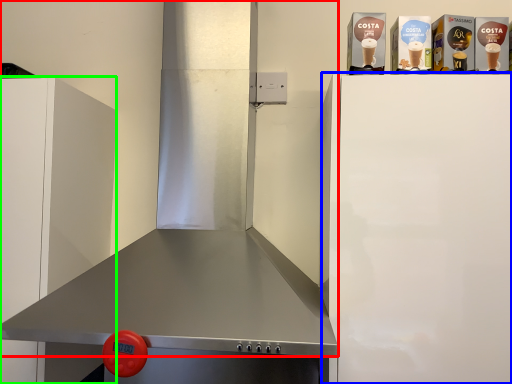
Question: Considering the real-world distances, which object is closest to exhaust hood (highlighted by a red box)? appliance (highlighted by a blue box) or cabinetry (highlighted by a green box).

Choices:
 (A) appliance
 (B) cabinetry

Answer: (A)